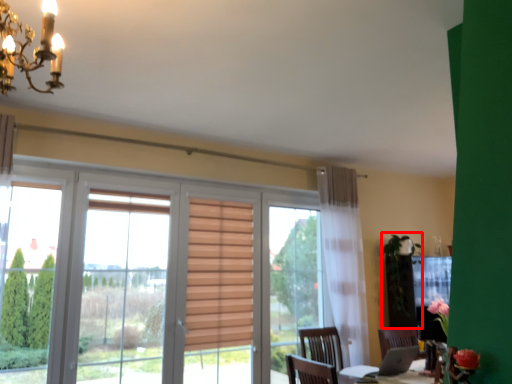
Question: Observing the image, what is the correct spatial positioning of plant (annotated by the red box) in reference to light fixture?

Choices:
 (A) left
 (B) right

Answer: (B)